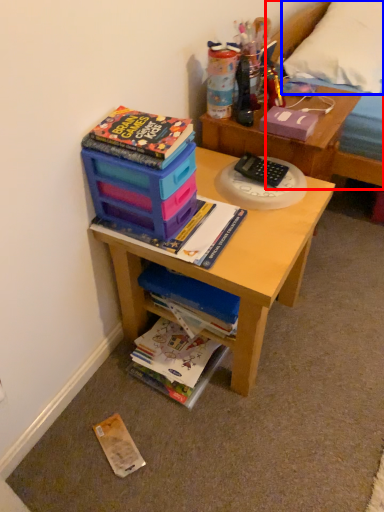
Question: Which point is further to the camera, bed frame (highlighted by a red box) or pillow (highlighted by a blue box)?

Choices:
 (A) bed frame
 (B) pillow

Answer: (B)